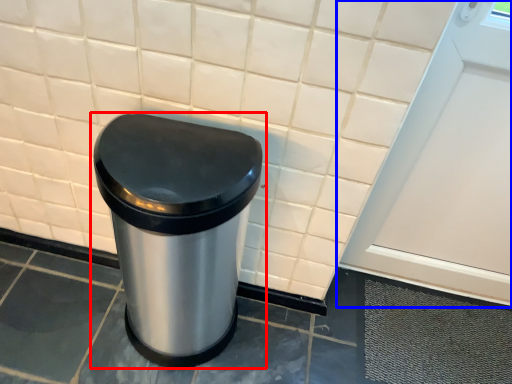
Question: Which object appears farthest to the camera in this image, waste container (highlighted by a red box) or screen door (highlighted by a blue box)?

Choices:
 (A) waste container
 (B) screen door

Answer: (B)